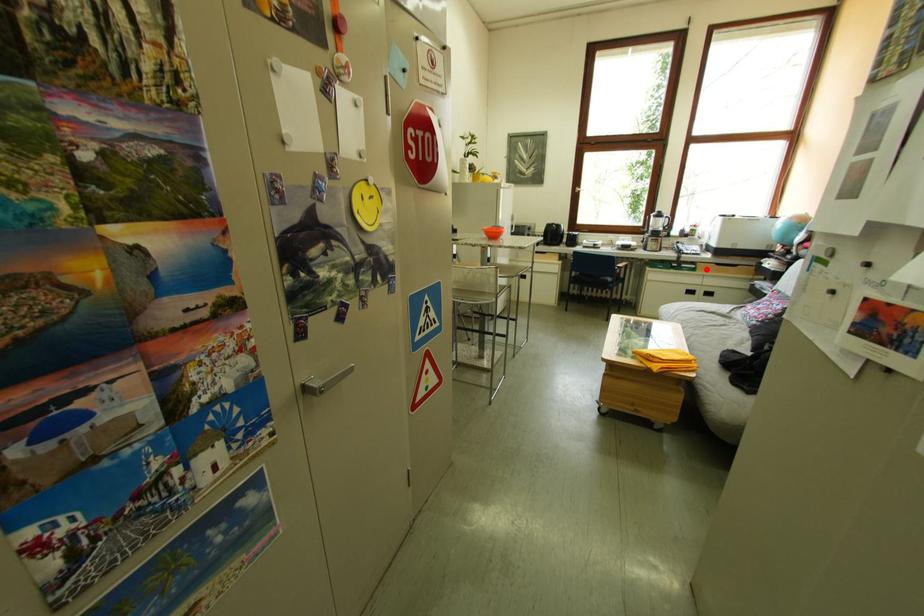
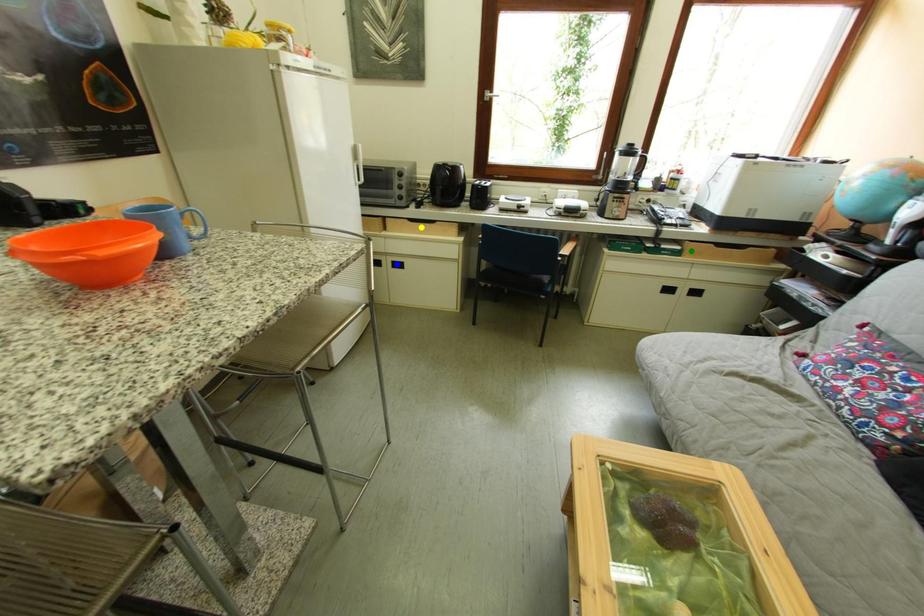
Question: I am providing you with two images of the same scene from different viewpoints. A red point is marked on the first image. You are given multiple points on the second image. Which spot in image 2 lines up with the point in image 1?

Choices:
 (A) yellow point
 (B) green point
 (C) blue point

Answer: (B)